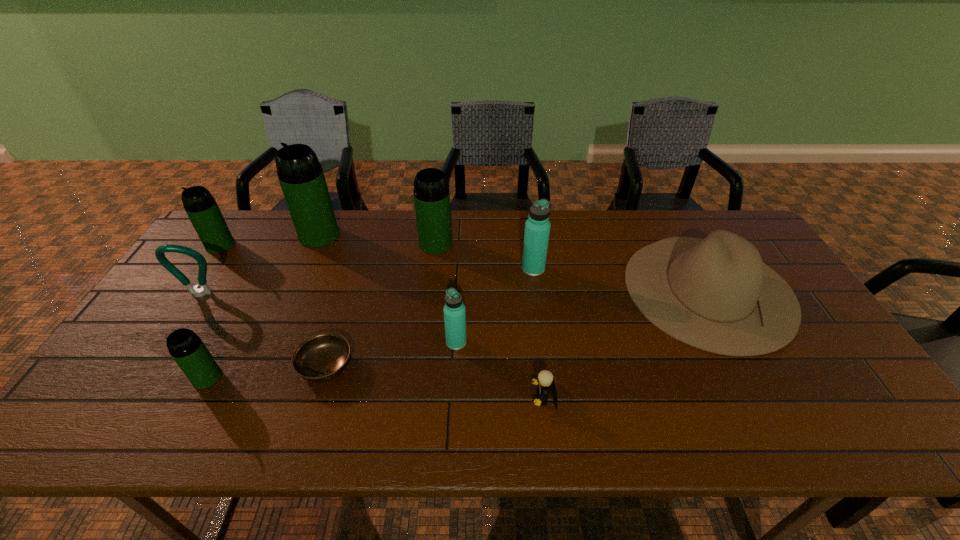
This screenshot has width=960, height=540. I want to click on vacant space located 0.130m from the spout of the leftmost green thermos bottle, so click(195, 282).

The height and width of the screenshot is (540, 960). Identify the location of vacant space positioned on the left of the farther aqua thermos bottle. (495, 269).

You are a GUI agent. You are given a task and a screenshot of the screen. Output one action in this format:
    pyautogui.click(x=<x>, y=<y>)
    Task: Click on the free spot located 0.360m at the jaws of the green bottle opener
    Image resolution: width=960 pixels, height=540 pixels.
    Given the screenshot: What is the action you would take?
    pyautogui.click(x=121, y=416)

Image resolution: width=960 pixels, height=540 pixels. Identify the location of vacant point located 0.330m on the left of the rightmost object. (515, 289).

The height and width of the screenshot is (540, 960). Identify the location of free space located 0.240m on the front of the second nearest thermos bottle. (x=451, y=440).

Locate an element on the screen. This screenshot has height=540, width=960. vacant space located 0.320m on the front-facing side of the ninth tallest object is located at coordinates (395, 398).

What are the coordinates of `vacant area situated 0.340m on the front-facing side of the ninth tallest object` in the screenshot? It's located at (386, 398).

Image resolution: width=960 pixels, height=540 pixels. Identify the location of vacant space located on the front-facing side of the ninth tallest object. (463, 398).

Where is `free space located on the left of the shortest object`? This screenshot has height=540, width=960. free space located on the left of the shortest object is located at coordinates (213, 366).

Where is `sombrero situated at the far edge`? This screenshot has height=540, width=960. sombrero situated at the far edge is located at coordinates (716, 294).